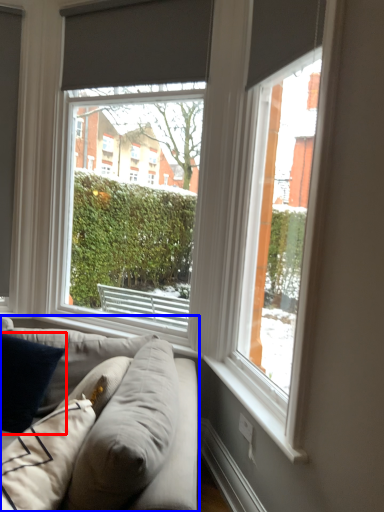
Question: Which object is closer to the camera taking this photo, pillow (highlighted by a red box) or studio couch (highlighted by a blue box)?

Choices:
 (A) pillow
 (B) studio couch

Answer: (B)